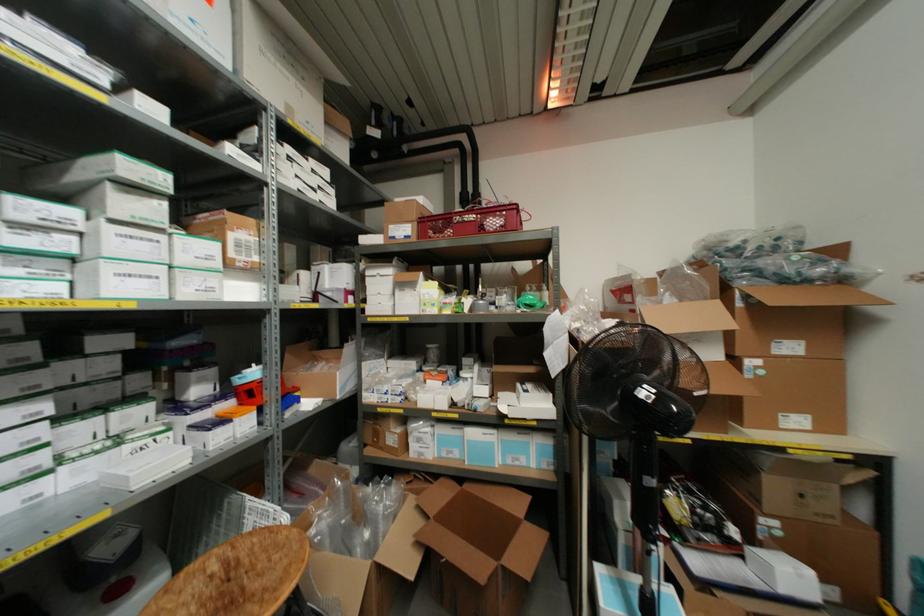
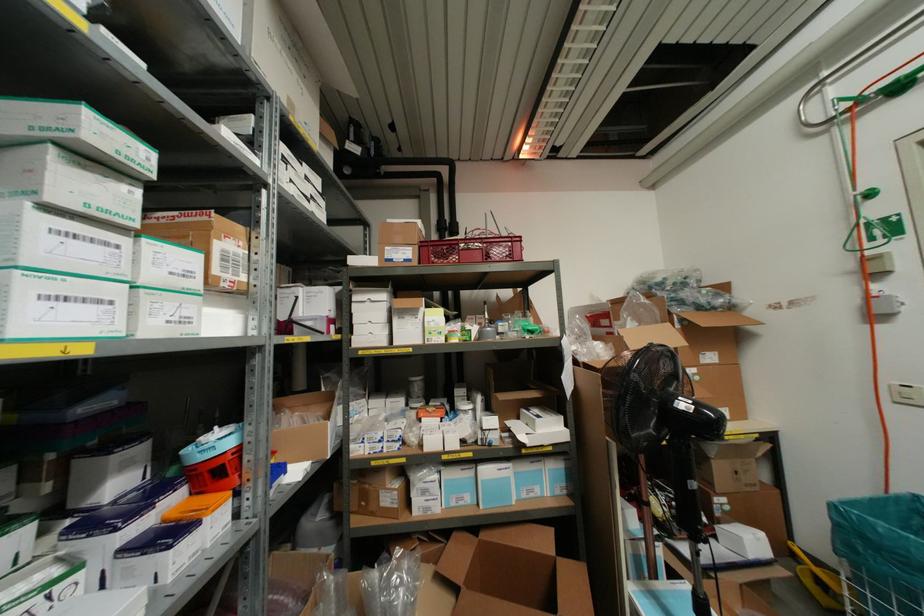
Where in the second image is the point corresponding to pixel 209 290 from the first image?

(185, 320)